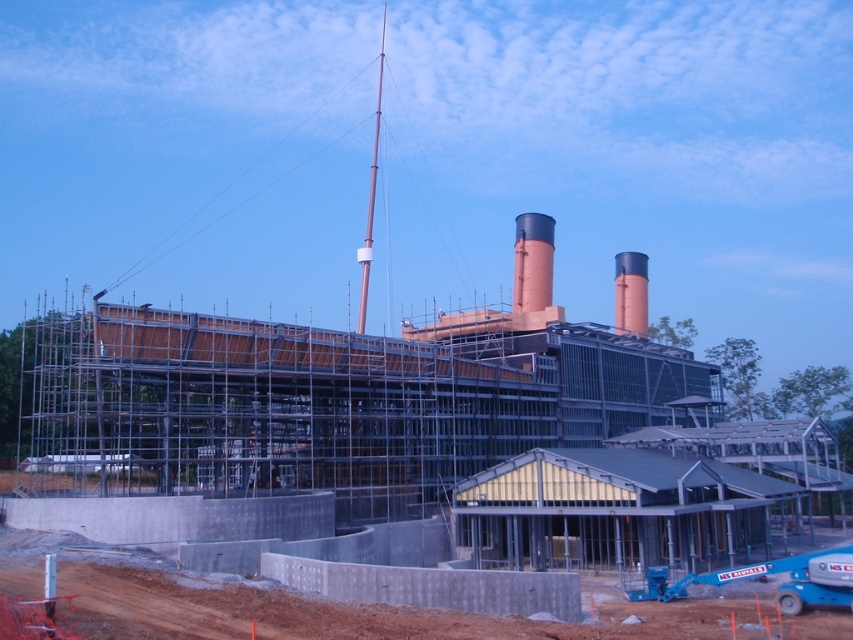
Measure the distance between metal scaffolding at center and brown dirt track at lower left.

metal scaffolding at center is 22.57 meters from brown dirt track at lower left.

At what (x,y) coordinates should I click in order to perform the action: click on metal scaffolding at center. Please return your answer as a coordinate pair (x, y). Looking at the image, I should click on (335, 403).

Identify the location of metal scaffolding at center. (335, 403).

Can you confirm if metal scaffolding at center is positioned below rustic brick chimney at center?

Yes, metal scaffolding at center is below rustic brick chimney at center.

Image resolution: width=853 pixels, height=640 pixels. What do you see at coordinates (335, 403) in the screenshot? I see `metal scaffolding at center` at bounding box center [335, 403].

The width and height of the screenshot is (853, 640). What are the coordinates of `metal scaffolding at center` in the screenshot? It's located at (335, 403).

From the picture: Can you confirm if brown dirt track at lower left is smaller than orange matte chimney at center-right?

Yes.

Is brown dirt track at lower left closer to camera compared to orange matte chimney at center-right?

Yes, it is.

Does point (146, 628) come closer to viewer compared to point (641, 305)?

Yes.

Locate an element on the screen. brown dirt track at lower left is located at coordinates (344, 612).